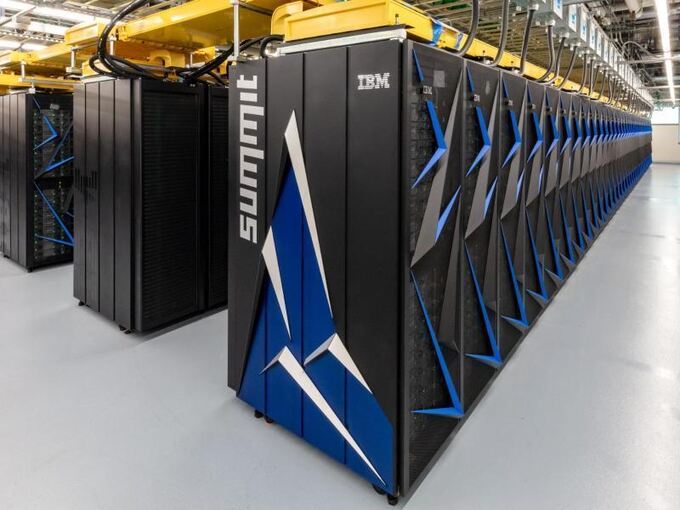
The height and width of the screenshot is (510, 680). What are the coordinates of `floor` in the screenshot? It's located at (609, 411).